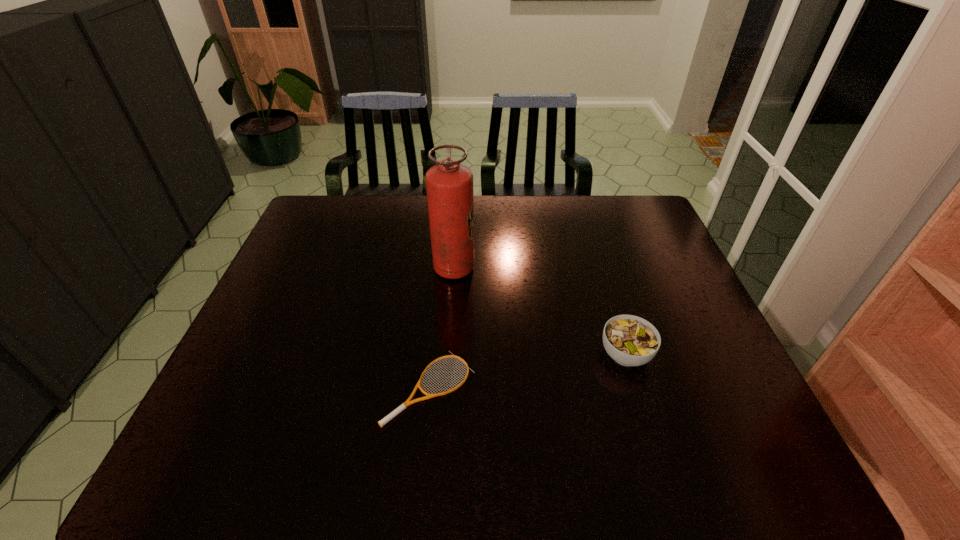
Find the location of a particular element. The width and height of the screenshot is (960, 540). vacant space at the left edge of the desktop is located at coordinates 297,366.

Identify the location of free location at the right edge of the desktop. The image size is (960, 540). (662, 267).

Locate an element on the screen. This screenshot has width=960, height=540. vacant area at the far left corner of the desktop is located at coordinates (317, 208).

In the image, there is a desktop. In order to click on vacant space at the near left corner in this screenshot , I will do [197, 450].

Locate an element on the screen. The height and width of the screenshot is (540, 960). free point between the tennis racket and the fire extinguisher is located at coordinates (442, 328).

Locate an element on the screen. This screenshot has height=540, width=960. vacant space that is in between the rightmost object and the tallest object is located at coordinates (540, 312).

At what (x,y) coordinates should I click in order to perform the action: click on free space between the tallest object and the tennis racket. Please return your answer as a coordinate pair (x, y). The image size is (960, 540). Looking at the image, I should click on (442, 328).

Find the location of a particular element. The height and width of the screenshot is (540, 960). vacant area between the shortest object and the rightmost object is located at coordinates (528, 371).

Where is `free space that is in between the shortest object and the second shortest object`? The image size is (960, 540). free space that is in between the shortest object and the second shortest object is located at coordinates (528, 371).

You are a GUI agent. You are given a task and a screenshot of the screen. Output one action in this format:
    pyautogui.click(x=<x>, y=<y>)
    Task: Click on the empty space between the tennis racket and the second shortest object
    Image resolution: width=960 pixels, height=540 pixels.
    Given the screenshot: What is the action you would take?
    pyautogui.click(x=528, y=371)